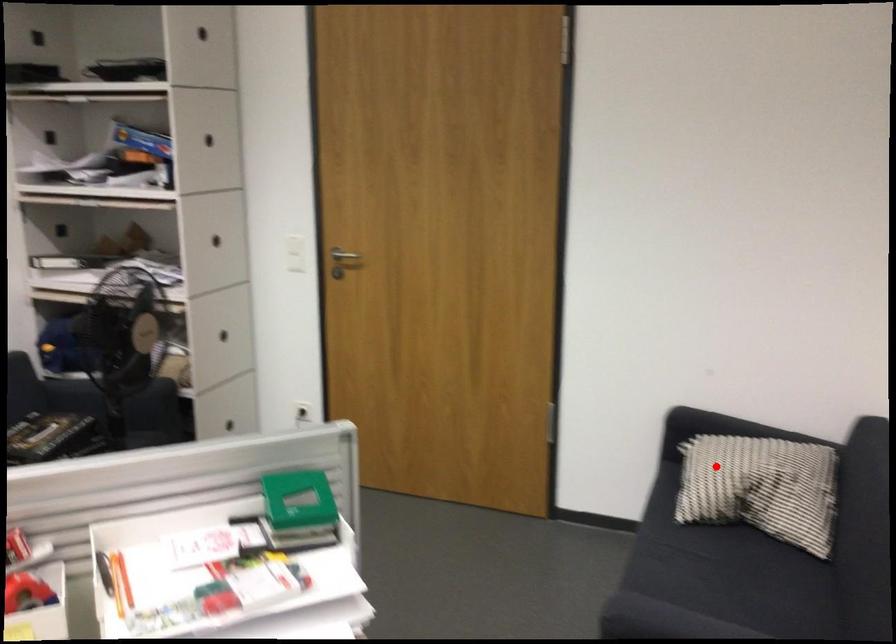
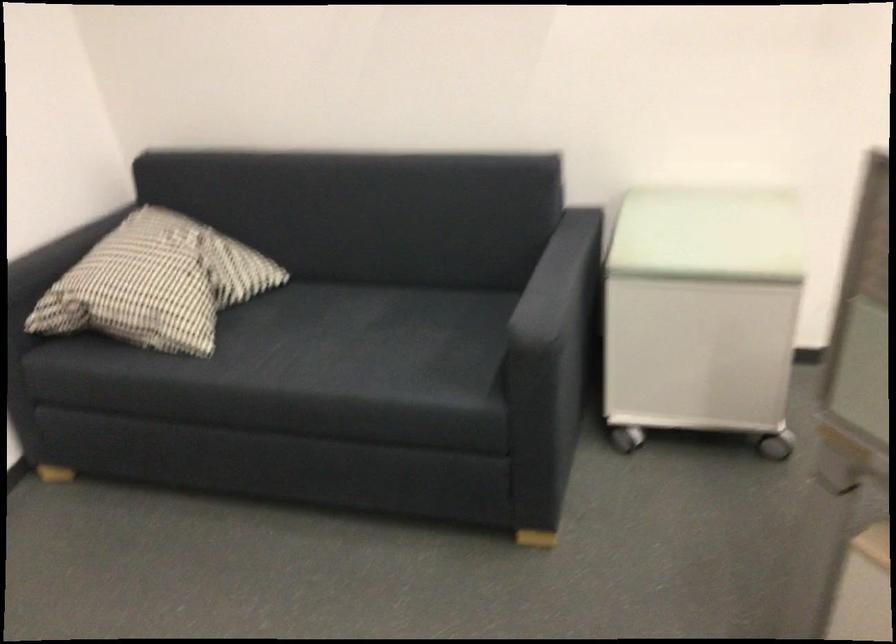
Locate, in the second image, the point that corresponds to the highlighted location in the first image.

(156, 283)